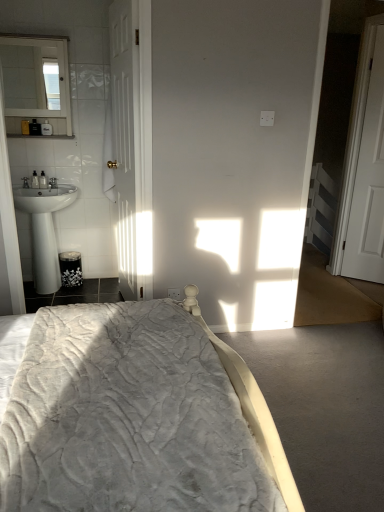
Question: Is white wooden door at left, the 1th door positioned from the left, thinner than white wooden door at right, placed as the 1th door when sorted from right to left?

Choices:
 (A) no
 (B) yes

Answer: (A)

Question: Is white wooden door at left, which is counted as the 2th door, starting from the right, located outside white wooden door at right, which appears as the 2th door when viewed from the left?

Choices:
 (A) no
 (B) yes

Answer: (B)

Question: Is white wooden door at left, the 1th door positioned from the left, beside white wooden door at right, placed as the 1th door when sorted from right to left?

Choices:
 (A) no
 (B) yes

Answer: (A)

Question: Considering the relative sizes of white wooden door at left, the 1th door positioned from the left, and white wooden door at right, placed as the 1th door when sorted from right to left, in the image provided, is white wooden door at left, the 1th door positioned from the left, smaller than white wooden door at right, placed as the 1th door when sorted from right to left,?

Choices:
 (A) no
 (B) yes

Answer: (A)

Question: Is white wooden door at left, which is counted as the 2th door, starting from the right, in front of white wooden door at right, placed as the 1th door when sorted from right to left?

Choices:
 (A) no
 (B) yes

Answer: (B)

Question: Would you say velvet grey bed at center is to the left or to the right of white glossy sink at left in the picture?

Choices:
 (A) left
 (B) right

Answer: (B)

Question: Is velvet grey bed at center taller or shorter than white glossy sink at left?

Choices:
 (A) tall
 (B) short

Answer: (A)

Question: In terms of size, does velvet grey bed at center appear bigger or smaller than white glossy sink at left?

Choices:
 (A) small
 (B) big

Answer: (B)

Question: Considering the positions of point (195, 499) and point (46, 271), is point (195, 499) closer or farther from the camera than point (46, 271)?

Choices:
 (A) closer
 (B) farther

Answer: (A)

Question: Visually, is velvet grey bed at center positioned to the left or to the right of white wooden door at left, the 1th door positioned from the left?

Choices:
 (A) right
 (B) left

Answer: (A)

Question: Would you say velvet grey bed at center is inside or outside white wooden door at left, which is counted as the 2th door, starting from the right?

Choices:
 (A) inside
 (B) outside

Answer: (B)

Question: Looking at their shapes, would you say velvet grey bed at center is wider or thinner than white wooden door at left, the 1th door positioned from the left?

Choices:
 (A) wide
 (B) thin

Answer: (A)

Question: From the image's perspective, is velvet grey bed at center above or below white wooden door at left, which is counted as the 2th door, starting from the right?

Choices:
 (A) below
 (B) above

Answer: (A)

Question: In the image, is white wooden door at left, which is counted as the 2th door, starting from the right, positioned in front of or behind white glossy mirror at upper left?

Choices:
 (A) front
 (B) behind

Answer: (A)

Question: Considering the positions of white wooden door at left, which is counted as the 2th door, starting from the right, and white glossy mirror at upper left in the image, is white wooden door at left, which is counted as the 2th door, starting from the right, wider or thinner than white glossy mirror at upper left?

Choices:
 (A) thin
 (B) wide

Answer: (A)